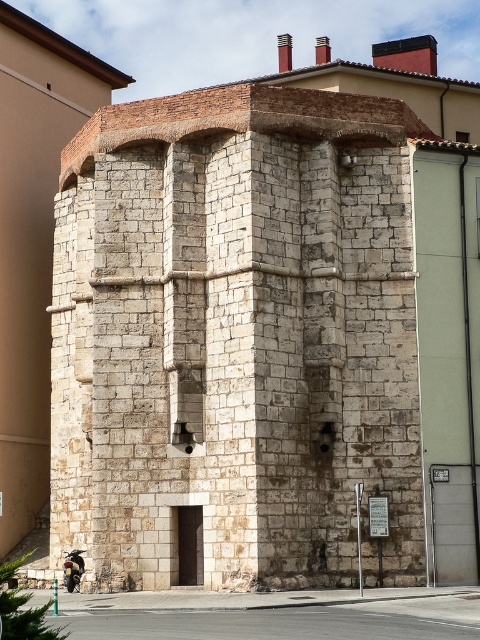
Measure the distance between white stone tower at center and camera.

white stone tower at center and camera are 44.88 meters apart.

Does white stone tower at center have a greater width compared to shiny chrome motorcycle at lower left?

Correct, the width of white stone tower at center exceeds that of shiny chrome motorcycle at lower left.

In order to click on white stone tower at center in this screenshot , I will do `click(233, 339)`.